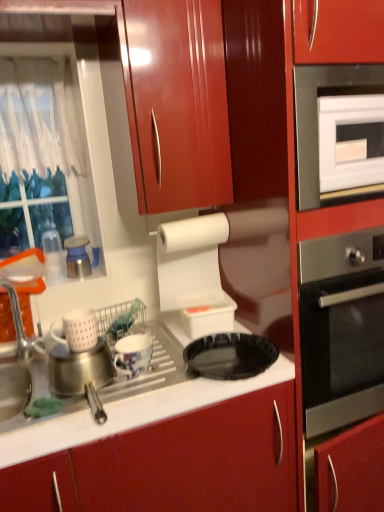
Question: Based on their sizes in the image, would you say clear plastic cups at left, which appears as the 5th appliance when viewed from the right, is bigger or smaller than white plastic container at upper center, the first appliance positioned from the right?

Choices:
 (A) small
 (B) big

Answer: (A)

Question: From the image's perspective, is clear plastic cups at left, marked as the 1th appliance in a left-to-right arrangement, positioned above or below white plastic container at upper center, which is the fifth appliance in left-to-right order?

Choices:
 (A) below
 (B) above

Answer: (B)

Question: Which object is the closest to the clear plastic cups at left, marked as the 1th appliance in a left-to-right arrangement?

Choices:
 (A) white matte mug at left, which is the 3th appliance from right to left
 (B) white plastic container at upper center, the first appliance positioned from the right
 (C) metallic blue and white kettle at left, which is the 4th appliance from right to left
 (D) green sponge at sink
 (E) black glossy plate at center

Answer: (C)

Question: Based on their relative distances, which object is nearer to the white matte mug at left, which is the 3th appliance from right to left?

Choices:
 (A) porcelain floral mug at center, which is the fourth appliance in left-to-right order
 (B) black glossy plate at center
 (C) white glossy oven at upper right
 (D) clear plastic cups at left, which appears as the 5th appliance when viewed from the right
 (E) white plastic container at upper center, which is the fifth appliance in left-to-right order

Answer: (A)